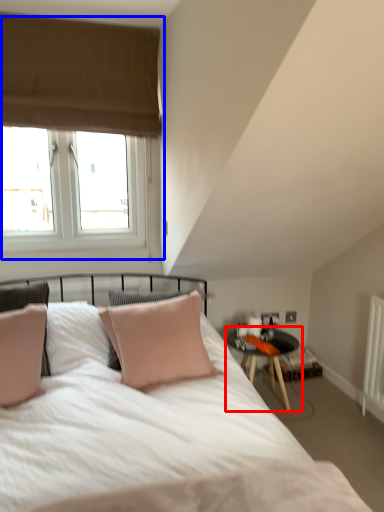
Question: Which object is further to the camera taking this photo, table (highlighted by a red box) or window (highlighted by a blue box)?

Choices:
 (A) table
 (B) window

Answer: (A)